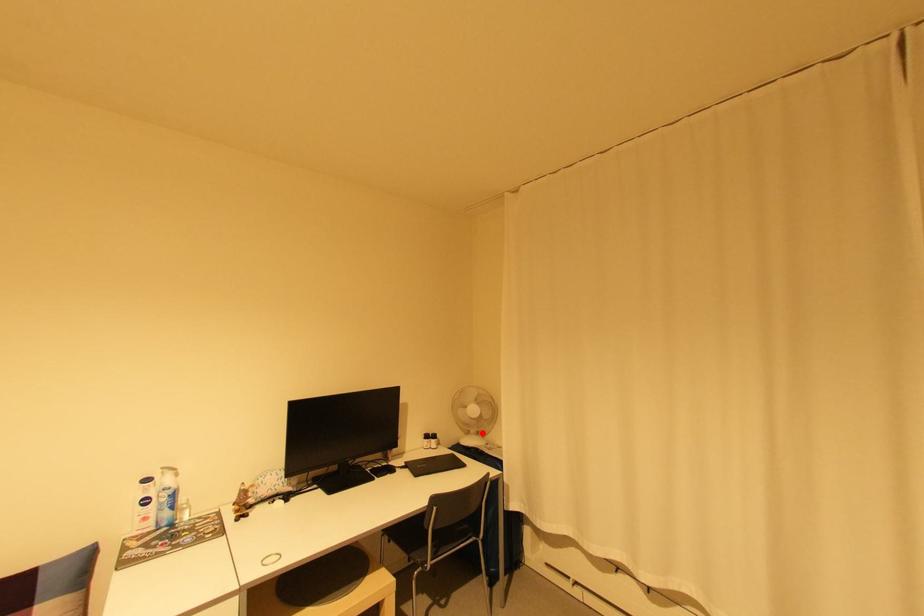
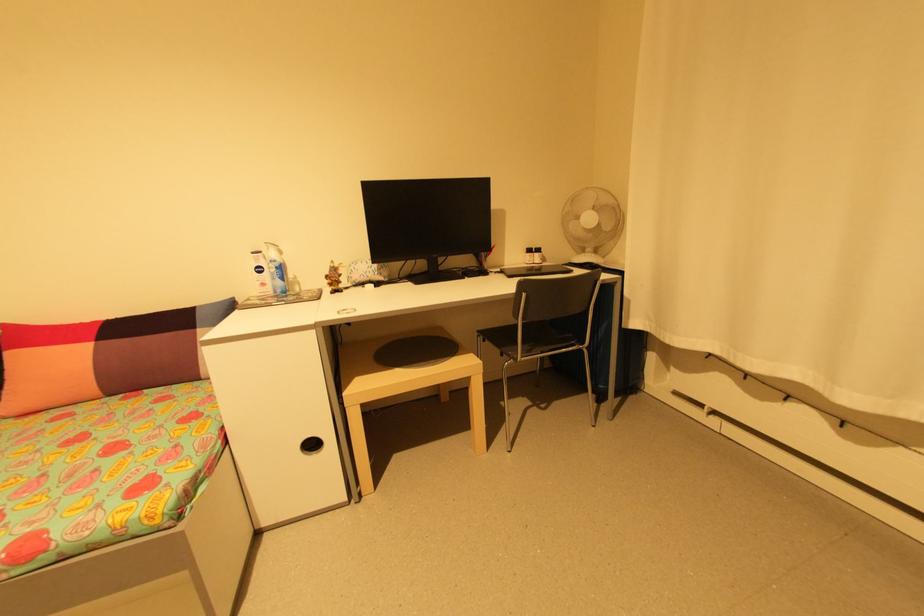
Question: A red point is marked in image1. In image2, is the corresponding 3D point closer to the camera or farther? Reply with the corresponding letter.

Choices:
 (A) The corresponding 3D point is closer.
 (B) The corresponding 3D point is farther.

Answer: (A)